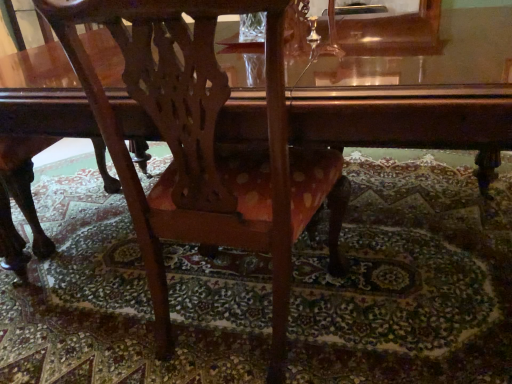
Describe the element at coordinates (188, 136) in the screenshot. This screenshot has height=384, width=512. I see `matte wood chair at center` at that location.

The height and width of the screenshot is (384, 512). In order to click on matte wood chair at center in this screenshot , I will do `click(188, 136)`.

Measure the distance between matte wood chair at center and camera.

They are 26.29 inches apart.

The width and height of the screenshot is (512, 384). Describe the element at coordinates (407, 119) in the screenshot. I see `glossy wood table at center` at that location.

The height and width of the screenshot is (384, 512). I want to click on glossy wood table at center, so click(x=407, y=119).

The height and width of the screenshot is (384, 512). Identify the location of matte wood chair at center. (188, 136).

Considering the positions of objects glossy wood table at center and matte wood chair at center in the image provided, who is more to the right, glossy wood table at center or matte wood chair at center?

From the viewer's perspective, glossy wood table at center appears more on the right side.

Is glossy wood table at center closer to the viewer compared to matte wood chair at center?

Yes.

Which is closer to the camera, (387,90) or (285,286)?

Point (387,90) is closer to the camera than point (285,286).

From the image's perspective, is glossy wood table at center above or below matte wood chair at center?

Clearly, from the image's perspective, glossy wood table at center is above matte wood chair at center.

From a real-world perspective, which is physically above, glossy wood table at center or matte wood chair at center?

From a 3D spatial view, matte wood chair at center is above.

Consider the image. Which object is thinner, glossy wood table at center or matte wood chair at center?

matte wood chair at center.

Who is taller, glossy wood table at center or matte wood chair at center?

Standing taller between the two is matte wood chair at center.

Does glossy wood table at center have a smaller size compared to matte wood chair at center?

No.

Is matte wood chair at center surrounded by glossy wood table at center?

Absolutely, matte wood chair at center is inside glossy wood table at center.

Is glossy wood table at center far from matte wood chair at center?

No, glossy wood table at center is in close proximity to matte wood chair at center.

Could you tell me if glossy wood table at center is turned towards matte wood chair at center?

Yes, glossy wood table at center is facing matte wood chair at center.

Can you tell me how much glossy wood table at center and matte wood chair at center differ in facing direction?

There is a 176-degree angle between the facing directions of glossy wood table at center and matte wood chair at center.

This screenshot has height=384, width=512. In order to click on table lying above the matte wood chair at center (from the image's perspective) in this screenshot , I will do `click(407, 119)`.

Can you confirm if matte wood chair at center is positioned to the left of glossy wood table at center?

Yes, matte wood chair at center is to the left of glossy wood table at center.

Relative to glossy wood table at center, is matte wood chair at center in front or behind?

matte wood chair at center is behind glossy wood table at center.

Which is in front, point (286, 157) or point (262, 126)?

The point (286, 157) is more forward.

From the image's perspective, which one is positioned higher, matte wood chair at center or glossy wood table at center?

glossy wood table at center is shown above in the image.

From a real-world perspective, is matte wood chair at center positioned under glossy wood table at center based on gravity?

Incorrect, from a real-world perspective, matte wood chair at center is higher than glossy wood table at center.

Considering the sizes of objects matte wood chair at center and glossy wood table at center in the image provided, who is wider, matte wood chair at center or glossy wood table at center?

Wider between the two is glossy wood table at center.

Considering the relative sizes of matte wood chair at center and glossy wood table at center in the image provided, is matte wood chair at center taller than glossy wood table at center?

Yes.

Looking at this image, who is smaller, matte wood chair at center or glossy wood table at center?

matte wood chair at center is smaller.

Is matte wood chair at center outside of glossy wood table at center?

That's incorrect, matte wood chair at center is not completely outside glossy wood table at center.

Is matte wood chair at center not close to glossy wood table at center?

No, matte wood chair at center is in close proximity to glossy wood table at center.

Is matte wood chair at center aimed at glossy wood table at center?

Yes, matte wood chair at center is aimed at glossy wood table at center.

Locate an element on the screen. Image resolution: width=512 pixels, height=384 pixels. table located above the matte wood chair at center (from the image's perspective) is located at coordinates click(407, 119).

The height and width of the screenshot is (384, 512). I want to click on chair above the glossy wood table at center (from a real-world perspective), so click(x=188, y=136).

This screenshot has width=512, height=384. I want to click on table to the right of matte wood chair at center, so click(407, 119).